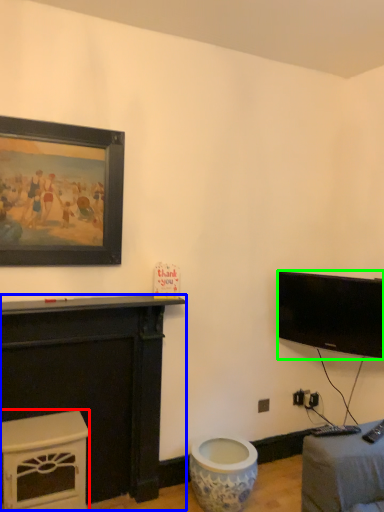
Question: Considering the real-world distances, which object is farthest from furniture (highlighted by a red box)? furniture (highlighted by a blue box) or television (highlighted by a green box)?

Choices:
 (A) furniture
 (B) television

Answer: (B)